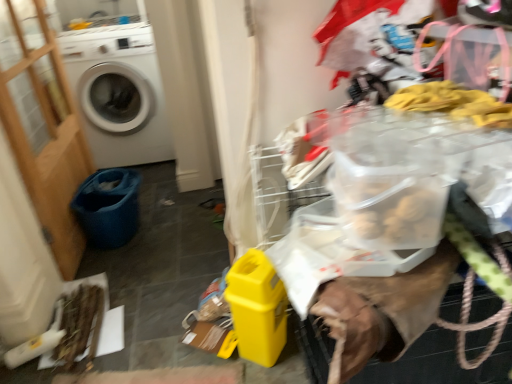
At what (x,y) coordinates should I click in order to perform the action: click on wooden screen door at left. Please return your answer as a coordinate pair (x, y). The height and width of the screenshot is (384, 512). Looking at the image, I should click on (42, 125).

Locate an element on the screen. blue fabric bucket at lower left is located at coordinates (108, 207).

From the picture: Who is taller, blue fabric bucket at lower left or white matte washing machine at left?

With more height is white matte washing machine at left.

Is point (112, 226) closer to camera compared to point (131, 75)?

Yes, it is.

In the scene shown: Which object is thinner, blue fabric bucket at lower left or white matte washing machine at left?

blue fabric bucket at lower left.

From the picture: Who is bigger, blue fabric bucket at lower left or white matte washing machine at left?

white matte washing machine at left is bigger.

Can you confirm if blue fabric bucket at lower left is positioned to the left of wooden screen door at left?

No.

Does blue fabric bucket at lower left have a lesser height compared to wooden screen door at left?

Yes, blue fabric bucket at lower left is shorter than wooden screen door at left.

Is blue fabric bucket at lower left aimed at wooden screen door at left?

No, blue fabric bucket at lower left is not oriented towards wooden screen door at left.

Which object is closer to the camera, blue fabric bucket at lower left or wooden screen door at left?

wooden screen door at left is more forward.

Is white matte washing machine at left not near wooden screen door at left?

No, there isn't a large distance between white matte washing machine at left and wooden screen door at left.

How many degrees apart are the facing directions of white matte washing machine at left and wooden screen door at left?

The angular difference between white matte washing machine at left and wooden screen door at left is 89 degrees.

Is white matte washing machine at left thinner than wooden screen door at left?

No, white matte washing machine at left is not thinner than wooden screen door at left.

How much distance is there between white matte washing machine at left and wooden screen door at left?

white matte washing machine at left is 17.63 inches away from wooden screen door at left.

Is point (157, 91) farther from camera compared to point (136, 178)?

That is True.

Consider the image. Which object is positioned more to the left, white matte washing machine at left or blue fabric bucket at lower left?

From the viewer's perspective, white matte washing machine at left appears more on the left side.

Measure the distance from white matte washing machine at left to blue fabric bucket at lower left.

The distance of white matte washing machine at left from blue fabric bucket at lower left is 23.23 inches.

Identify the location of washing machine on the left of blue fabric bucket at lower left. (118, 93).

Measure the distance between wooden screen door at left and white matte washing machine at left.

Result: wooden screen door at left is 17.63 inches from white matte washing machine at left.

Between wooden screen door at left and white matte washing machine at left, which one appears on the right side from the viewer's perspective?

wooden screen door at left.

Is wooden screen door at left looking in the opposite direction of white matte washing machine at left?

No, wooden screen door at left's orientation is not away from white matte washing machine at left.

Consider the image. Considering the relative sizes of wooden screen door at left and white matte washing machine at left in the image provided, is wooden screen door at left smaller than white matte washing machine at left?

Indeed, wooden screen door at left has a smaller size compared to white matte washing machine at left.

Locate an element on the screen. The height and width of the screenshot is (384, 512). screen door positioned vertically above the blue fabric bucket at lower left (from a real-world perspective) is located at coordinates (42, 125).

From the image's perspective, would you say wooden screen door at left is positioned over blue fabric bucket at lower left?

Yes.

Is blue fabric bucket at lower left at the back of wooden screen door at left?

Yes, blue fabric bucket at lower left is at the back of wooden screen door at left.

From a real-world perspective, is wooden screen door at left positioned under blue fabric bucket at lower left based on gravity?

No, from a real-world perspective, wooden screen door at left is not beneath blue fabric bucket at lower left.

Where is `washing machine lying above the blue fabric bucket at lower left (from the image's perspective)`? Image resolution: width=512 pixels, height=384 pixels. washing machine lying above the blue fabric bucket at lower left (from the image's perspective) is located at coordinates 118,93.

This screenshot has height=384, width=512. I want to click on screen door lying in front of the blue fabric bucket at lower left, so click(42, 125).

Based on their spatial positions, is white matte washing machine at left or wooden screen door at left further from blue fabric bucket at lower left?

The object further to blue fabric bucket at lower left is white matte washing machine at left.

Which object lies further to the anchor point white matte washing machine at left, wooden screen door at left or blue fabric bucket at lower left?

blue fabric bucket at lower left is further to white matte washing machine at left.

Estimate the real-world distances between objects in this image. Which object is closer to white matte washing machine at left, blue fabric bucket at lower left or wooden screen door at left?

Based on the image, wooden screen door at left appears to be nearer to white matte washing machine at left.

In the scene shown: Looking at the image, which one is located closer to blue fabric bucket at lower left, wooden screen door at left or white matte washing machine at left?

wooden screen door at left is positioned closer to the anchor blue fabric bucket at lower left.

Based on their spatial positions, is white matte washing machine at left or blue fabric bucket at lower left closer to wooden screen door at left?

The object closer to wooden screen door at left is blue fabric bucket at lower left.

When comparing their distances from wooden screen door at left, does blue fabric bucket at lower left or white matte washing machine at left seem closer?

blue fabric bucket at lower left is closer to wooden screen door at left.

The height and width of the screenshot is (384, 512). I want to click on recycling bin between wooden screen door at left and white matte washing machine at left from front to back, so click(x=108, y=207).